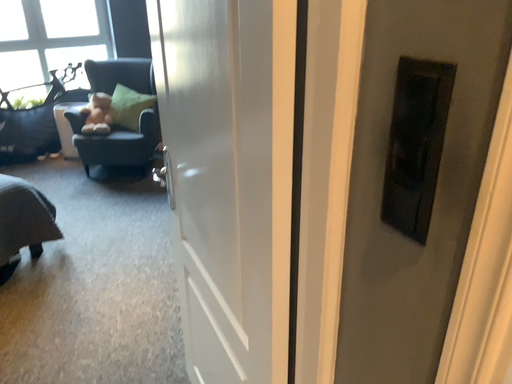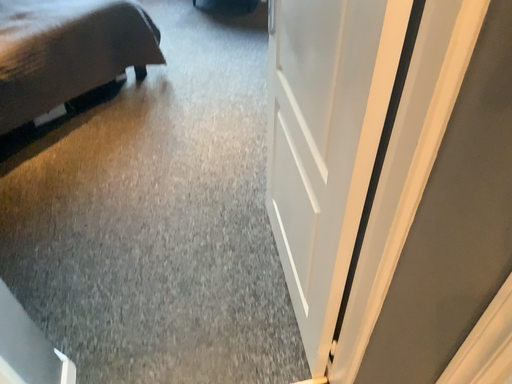
Question: Which way did the camera rotate in the video?

Choices:
 (A) rotated left
 (B) rotated right

Answer: (A)